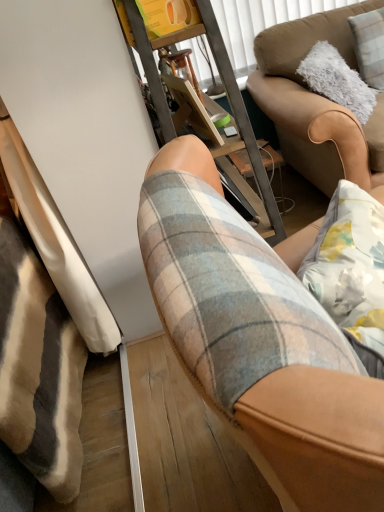
Question: In terms of width, does plaid fabric shorts at center look wider or thinner when compared to metal frame at center?

Choices:
 (A) wide
 (B) thin

Answer: (A)

Question: Considering their positions, is plaid fabric shorts at center located in front of or behind metal frame at center?

Choices:
 (A) front
 (B) behind

Answer: (A)

Question: Which object is the farthest from the plaid fabric shorts at center?

Choices:
 (A) fluffy white pillow at upper right
 (B) metal frame at center
 (C) brown leather couch at upper right

Answer: (A)

Question: Considering the real-world distances, which object is closest to the metal frame at center?

Choices:
 (A) brown leather couch at upper right
 (B) fluffy white pillow at upper right
 (C) plaid fabric shorts at center

Answer: (A)